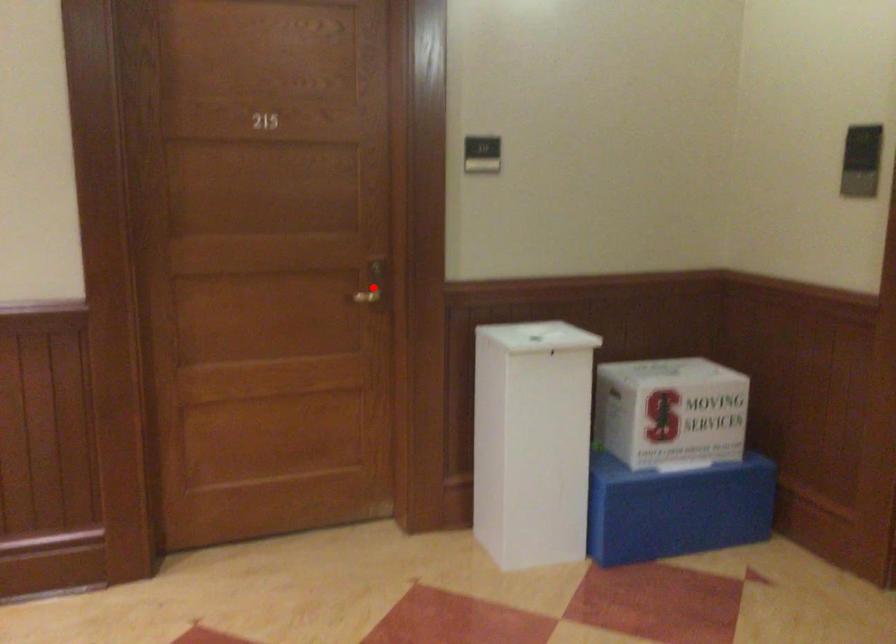
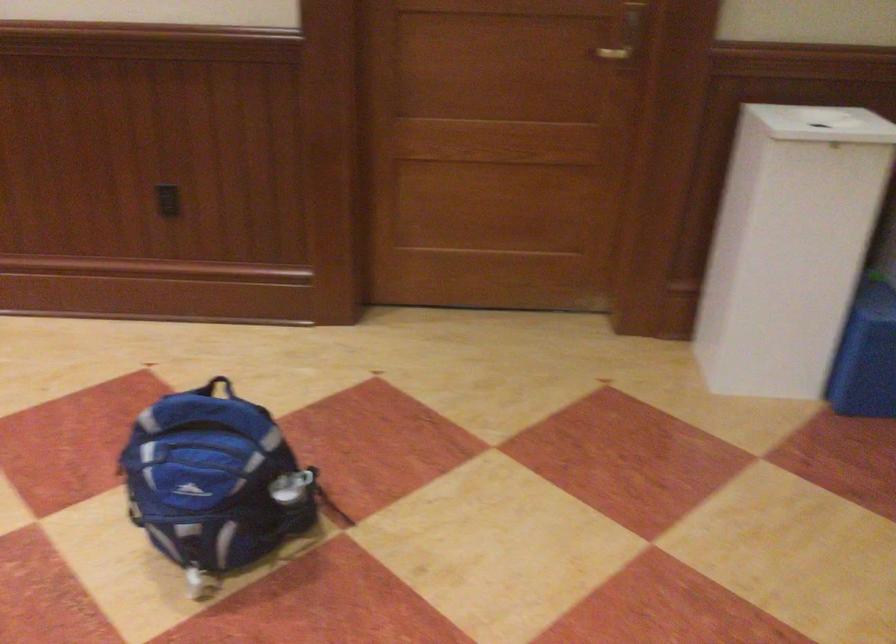
Find the pixel in the second image that matches the highlighted location in the first image.

(625, 40)